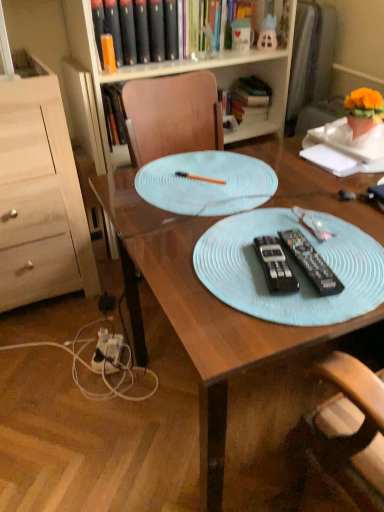
Locate an element on the screen. vacant space that's between black plastic remote control at center, the 2th remote control positioned from the left, and white paper at upper right is located at coordinates (323, 206).